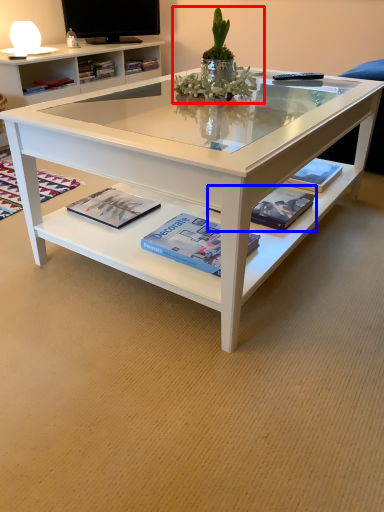
Question: Which object appears closest to the camera in this image, floral arrangement (highlighted by a red box) or magazine (highlighted by a blue box)?

Choices:
 (A) floral arrangement
 (B) magazine

Answer: (A)